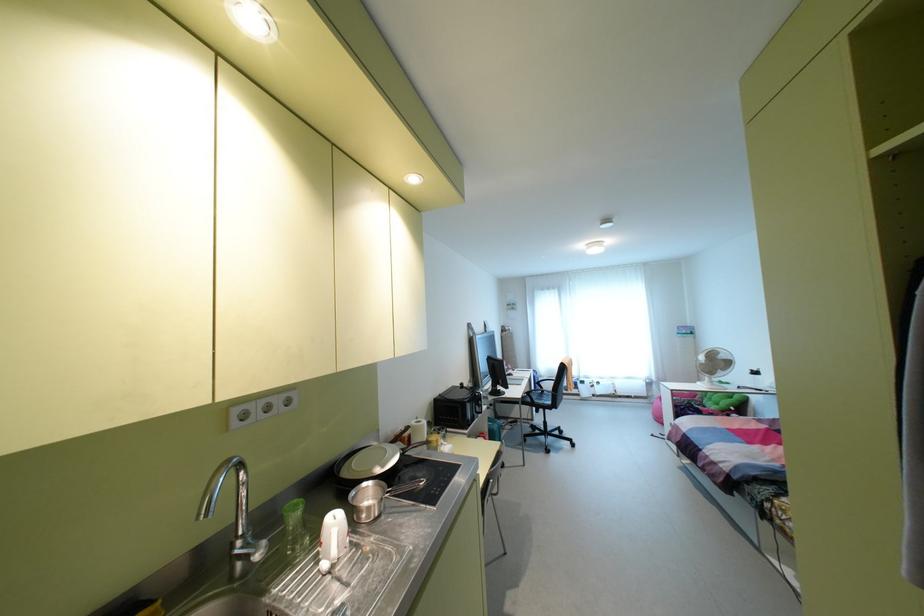
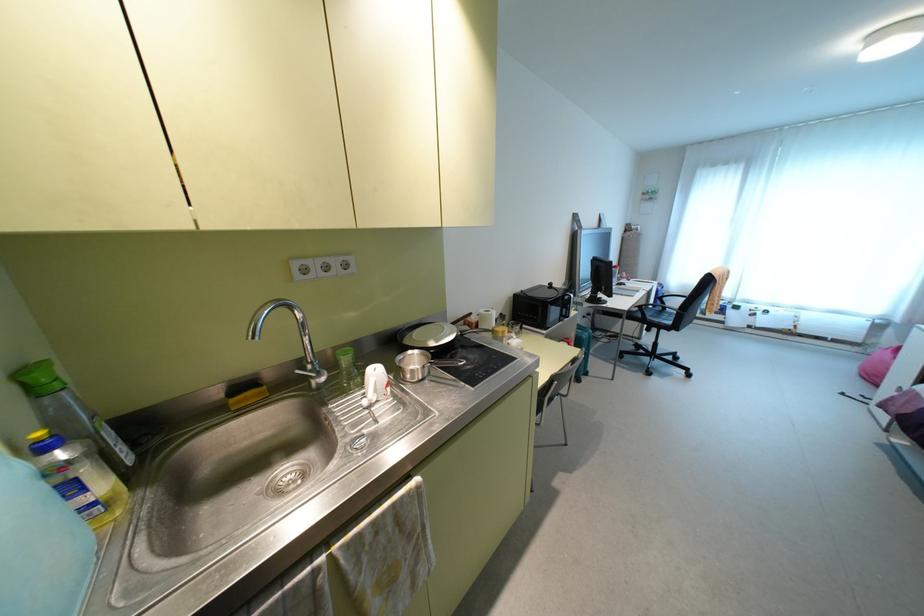
The images are taken continuously from a first-person perspective. In which direction is your viewpoint rotating?

The rotation direction of the camera is left-down.